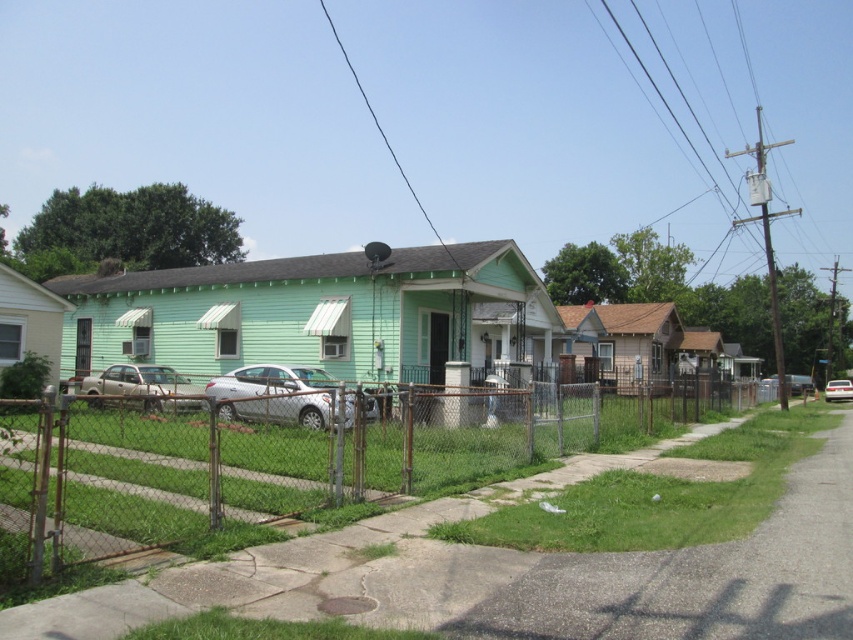
Is rusty chain-link fence at center shorter than white glossy sedan at center?

No.

Between rusty chain-link fence at center and white glossy sedan at center, which one appears on the right side from the viewer's perspective?

Positioned to the right is white glossy sedan at center.

Between point (451, 451) and point (833, 385), which one is positioned in front?

Point (451, 451) is more forward.

Locate an element on the screen. rusty chain-link fence at center is located at coordinates (444, 442).

Is point (172, 394) closer to camera compared to point (833, 392)?

Yes, point (172, 394) is closer to viewer.

Does matte silver sedan at left have a smaller size compared to white glossy sedan at center?

Yes, matte silver sedan at left is smaller than white glossy sedan at center.

The width and height of the screenshot is (853, 640). What do you see at coordinates (142, 387) in the screenshot? I see `matte silver sedan at left` at bounding box center [142, 387].

Where is `matte silver sedan at left`? The height and width of the screenshot is (640, 853). matte silver sedan at left is located at coordinates (142, 387).

Is rusty chain-link fence at center to the left of matte silver sedan at left from the viewer's perspective?

Incorrect, rusty chain-link fence at center is not on the left side of matte silver sedan at left.

Identify the location of rusty chain-link fence at center. (444, 442).